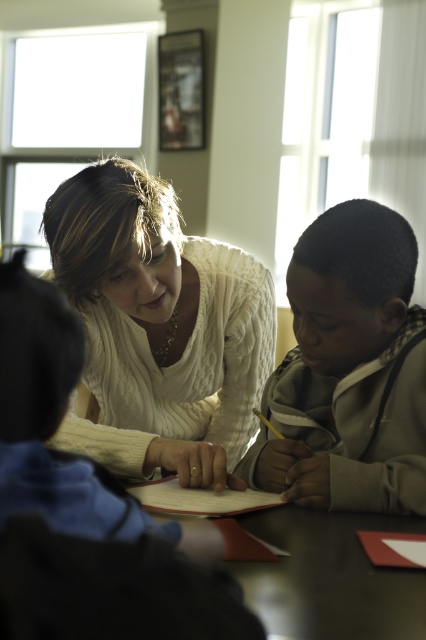
Is the position of light brown hoodie at right less distant than that of smooth dark wood table at center?

No, it is behind smooth dark wood table at center.

Who is shorter, light brown hoodie at right or smooth dark wood table at center?

With less height is smooth dark wood table at center.

Where is `light brown hoodie at right`? light brown hoodie at right is located at coordinates (348, 369).

Can you confirm if white cable-knit sweater at center is positioned below smooth dark wood table at center?

Actually, white cable-knit sweater at center is above smooth dark wood table at center.

Which is in front, point (80, 227) or point (377, 593)?

Positioned in front is point (377, 593).

The height and width of the screenshot is (640, 426). Identify the location of white cable-knit sweater at center. (158, 326).

At what (x,y) coordinates should I click in order to perform the action: click on white cable-knit sweater at center. Please return your answer as a coordinate pair (x, y). This screenshot has width=426, height=640. Looking at the image, I should click on tap(158, 326).

Who is lower down, white cable-knit sweater at center or light brown hoodie at right?

light brown hoodie at right is lower down.

Which is more to the right, white cable-knit sweater at center or light brown hoodie at right?

Positioned to the right is light brown hoodie at right.

Which is behind, point (83, 445) or point (400, 493)?

Positioned behind is point (83, 445).

I want to click on white cable-knit sweater at center, so click(158, 326).